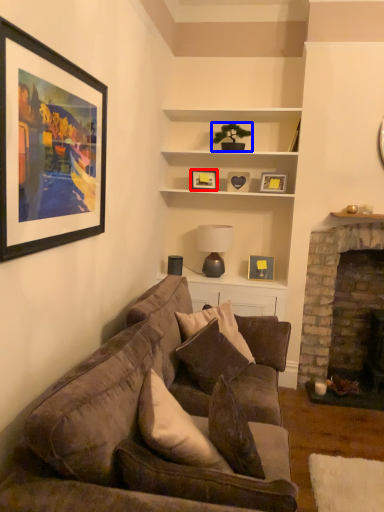
Question: Which point is closer to the camera, picture frame (highlighted by a red box) or houseplant (highlighted by a blue box)?

Choices:
 (A) picture frame
 (B) houseplant

Answer: (B)